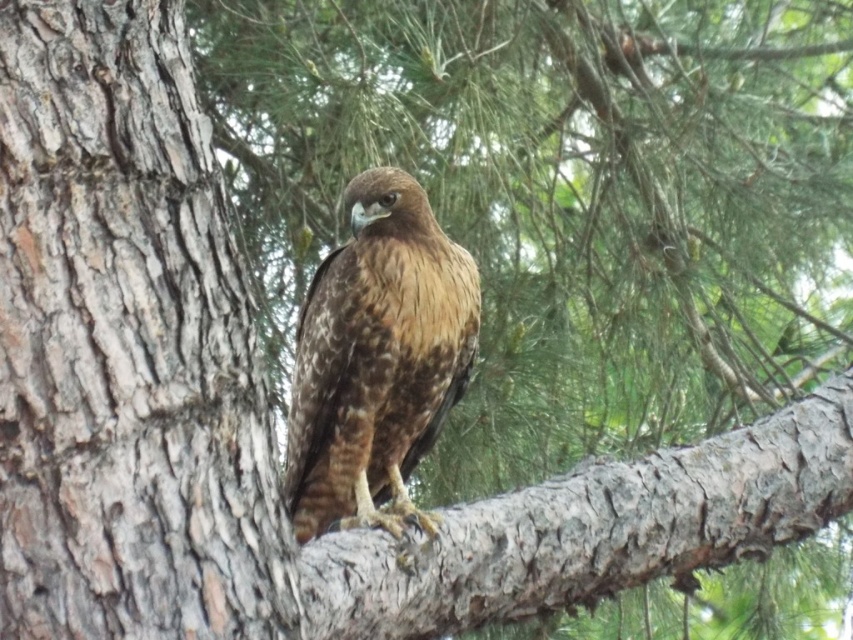
Question: Is smooth bark branch at center positioned in front of brown speckled feathers at center?

Choices:
 (A) yes
 (B) no

Answer: (A)

Question: Considering the relative positions of smooth bark tree trunk at center and smooth bark branch at center in the image provided, where is smooth bark tree trunk at center located with respect to smooth bark branch at center?

Choices:
 (A) above
 (B) below

Answer: (A)

Question: Can you confirm if smooth bark tree trunk at center is smaller than brown speckled feathers at center?

Choices:
 (A) no
 (B) yes

Answer: (B)

Question: Which of the following is the closest to the observer?

Choices:
 (A) brown speckled feathers at center
 (B) smooth bark tree trunk at center
 (C) smooth bark branch at center

Answer: (B)

Question: Which point is farther to the camera?

Choices:
 (A) (474, 536)
 (B) (447, 328)

Answer: (B)

Question: Which object is farther from the camera taking this photo?

Choices:
 (A) smooth bark branch at center
 (B) smooth bark tree trunk at center
 (C) brown speckled feathers at center

Answer: (C)